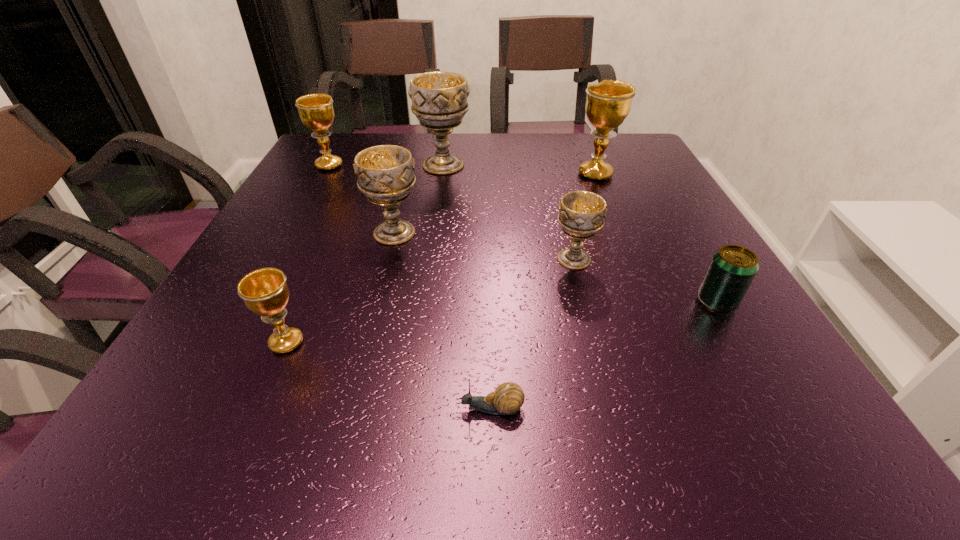
This screenshot has height=540, width=960. What are the coordinates of `the third nearest object` in the screenshot? It's located at (732, 269).

You are a GUI agent. You are given a task and a screenshot of the screen. Output one action in this format:
    pyautogui.click(x=<x>, y=<y>)
    Task: Click on the second shortest object
    The image size is (960, 540).
    Given the screenshot: What is the action you would take?
    pyautogui.click(x=732, y=269)

Where is `escargot`? This screenshot has width=960, height=540. escargot is located at coordinates (507, 399).

The height and width of the screenshot is (540, 960). I want to click on the nearest object, so click(x=507, y=399).

Find the location of a particular element. blank space located 0.260m on the left of the biggest white chalice is located at coordinates (321, 165).

The height and width of the screenshot is (540, 960). Identify the location of vacant space located on the left of the rightmost chalice. (457, 174).

Image resolution: width=960 pixels, height=540 pixels. I want to click on vacant space located 0.280m on the front of the second smallest gold chalice, so click(x=291, y=235).

You are a GUI agent. You are given a task and a screenshot of the screen. Output one action in this format:
    pyautogui.click(x=<x>, y=<y>)
    Task: Click on the vacant region located 0.240m on the right of the second biggest white chalice
    This screenshot has height=540, width=960.
    Given the screenshot: What is the action you would take?
    pyautogui.click(x=531, y=233)

Find the location of a particular element. The height and width of the screenshot is (540, 960). vacant position located on the left of the smallest white chalice is located at coordinates (420, 259).

This screenshot has width=960, height=540. I want to click on vacant space located 0.280m on the right of the nearest gold chalice, so click(x=475, y=342).